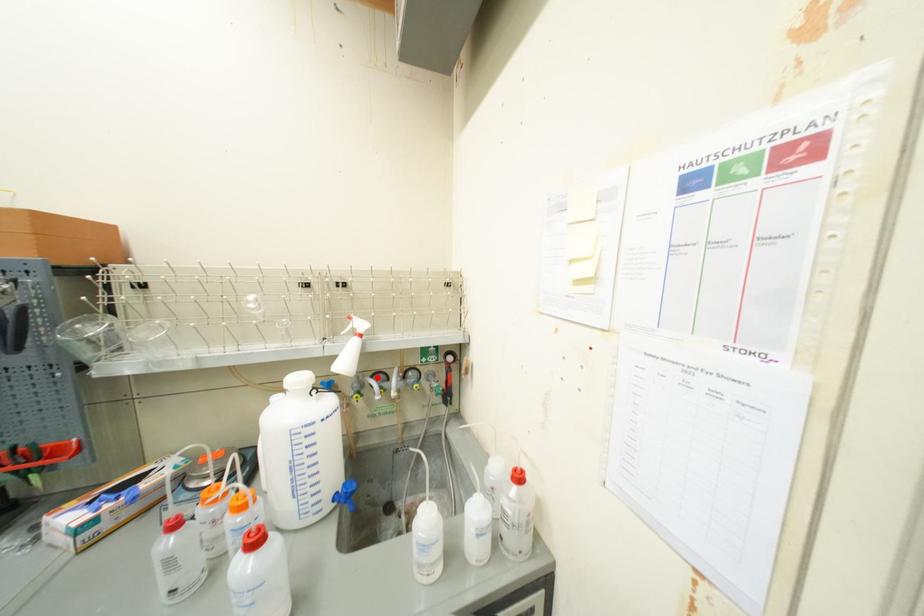
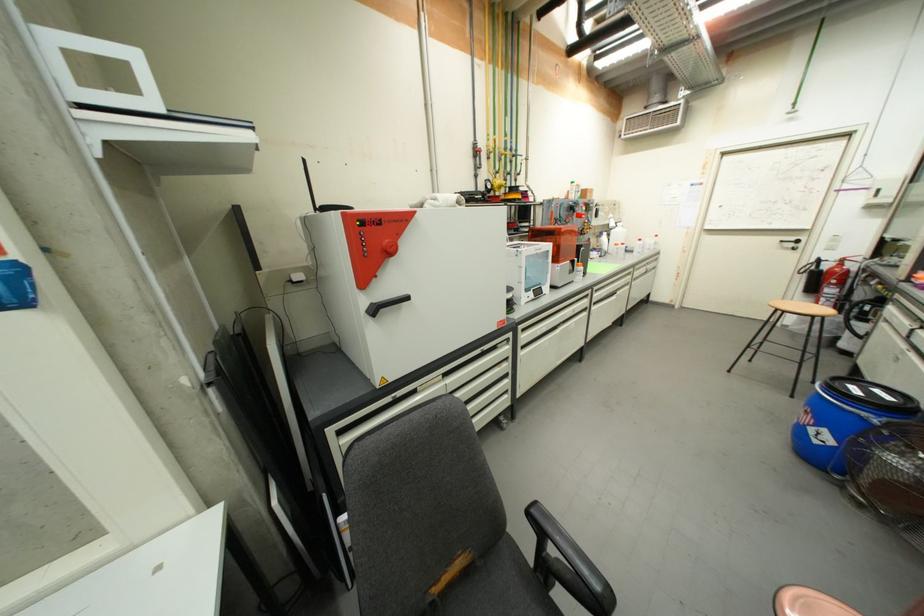
Question: I am providing you with two images of the same scene from different viewpoints. A red point is marked on the first image. Is the red point's position out of view in image 2?

Choices:
 (A) Yes
 (B) No

Answer: (A)